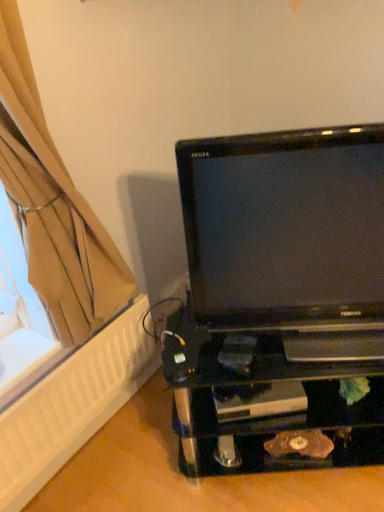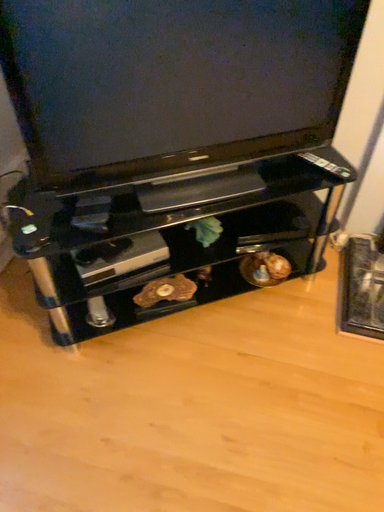
Question: Which way did the camera rotate in the video?

Choices:
 (A) rotated downward
 (B) rotated upward

Answer: (A)